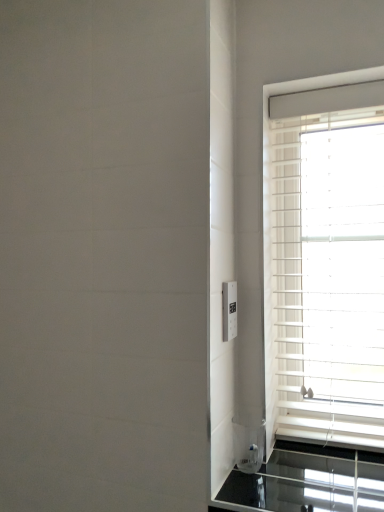
What are the coordinates of `white plastic electric outlet at right` in the screenshot? It's located at (229, 310).

The height and width of the screenshot is (512, 384). Describe the element at coordinates (229, 310) in the screenshot. I see `white plastic electric outlet at right` at that location.

In order to face white plastic electric outlet at right, should I rotate leftwards or rightwards?

Turn right by 5.336 degrees to look at white plastic electric outlet at right.

You are a GUI agent. You are given a task and a screenshot of the screen. Output one action in this format:
    pyautogui.click(x=<x>, y=<y>)
    Task: Click on the white plastic blinds at right
    The width and height of the screenshot is (384, 512).
    Given the screenshot: What is the action you would take?
    pyautogui.click(x=272, y=210)

This screenshot has width=384, height=512. Describe the element at coordinates (272, 210) in the screenshot. I see `white plastic blinds at right` at that location.

The image size is (384, 512). In order to click on white plastic electric outlet at right in this screenshot , I will do `click(229, 310)`.

Which is more to the right, white plastic blinds at right or white plastic electric outlet at right?

white plastic blinds at right is more to the right.

Relative to white plastic electric outlet at right, is white plastic blinds at right in front or behind?

white plastic blinds at right is behind white plastic electric outlet at right.

Which is behind, point (270, 429) or point (226, 322)?

Point (270, 429)

From the image's perspective, which object appears higher, white plastic blinds at right or white plastic electric outlet at right?

white plastic blinds at right is shown above in the image.

From a real-world perspective, between white plastic blinds at right and white plastic electric outlet at right, who is vertically lower?

white plastic electric outlet at right, from a real-world perspective.

Considering the sizes of objects white plastic blinds at right and white plastic electric outlet at right in the image provided, who is wider, white plastic blinds at right or white plastic electric outlet at right?

white plastic blinds at right.

Considering the sizes of objects white plastic blinds at right and white plastic electric outlet at right in the image provided, who is shorter, white plastic blinds at right or white plastic electric outlet at right?

Standing shorter between the two is white plastic electric outlet at right.

Can you confirm if white plastic blinds at right is smaller than white plastic electric outlet at right?

Actually, white plastic blinds at right might be larger than white plastic electric outlet at right.

Is white plastic blinds at right inside the boundaries of white plastic electric outlet at right, or outside?

white plastic blinds at right is located beyond the bounds of white plastic electric outlet at right.

Would you say white plastic blinds at right is a long distance from white plastic electric outlet at right?

white plastic blinds at right is actually quite close to white plastic electric outlet at right.

Is white plastic blinds at right positioned with its back to white plastic electric outlet at right?

white plastic blinds at right does not have its back to white plastic electric outlet at right.

What's the angular difference between white plastic blinds at right and white plastic electric outlet at right's facing directions?

The angular difference between white plastic blinds at right and white plastic electric outlet at right is 90.8 degrees.

At what (x,y) coordinates should I click in order to perform the action: click on window above the white plastic electric outlet at right (from a real-world perspective). Please return your answer as a coordinate pair (x, y). This screenshot has width=384, height=512. Looking at the image, I should click on (272, 210).

Between white plastic electric outlet at right and white plastic blinds at right, which one appears on the right side from the viewer's perspective?

Positioned to the right is white plastic blinds at right.

Is the depth of white plastic electric outlet at right greater than that of white plastic blinds at right?

No, white plastic electric outlet at right is closer to the viewer.

Is point (232, 286) closer or farther from the camera than point (370, 80)?

Point (232, 286) is closer to the camera than point (370, 80).

From the image's perspective, which one is positioned higher, white plastic electric outlet at right or white plastic blinds at right?

white plastic blinds at right, from the image's perspective.

From a real-world perspective, which is physically above, white plastic electric outlet at right or white plastic blinds at right?

From a 3D spatial view, white plastic blinds at right is above.

Considering the sizes of objects white plastic electric outlet at right and white plastic blinds at right in the image provided, who is thinner, white plastic electric outlet at right or white plastic blinds at right?

white plastic electric outlet at right is thinner.

Which of these two, white plastic electric outlet at right or white plastic blinds at right, stands taller?

white plastic blinds at right is taller.

Who is bigger, white plastic electric outlet at right or white plastic blinds at right?

With larger size is white plastic blinds at right.

Is white plastic blinds at right a part of white plastic electric outlet at right?

No, white plastic blinds at right is not surrounded by white plastic electric outlet at right.

Are white plastic electric outlet at right and white plastic blinds at right making contact?

No, white plastic electric outlet at right is not beside white plastic blinds at right.

Does white plastic electric outlet at right turn towards white plastic blinds at right?

No, white plastic electric outlet at right is not aimed at white plastic blinds at right.

What's the angular difference between white plastic electric outlet at right and white plastic blinds at right's facing directions?

They differ by 90.8 degrees in their facing directions.

Locate an element on the screen. window that is above the white plastic electric outlet at right (from a real-world perspective) is located at coordinates (272, 210).

The image size is (384, 512). Find the location of `window behind the white plastic electric outlet at right`. window behind the white plastic electric outlet at right is located at coordinates (272, 210).

The height and width of the screenshot is (512, 384). I want to click on electric outlet that is below the white plastic blinds at right (from the image's perspective), so click(229, 310).